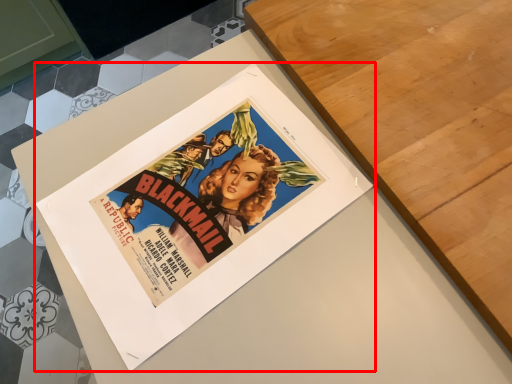
Question: From the image's perspective, where is poster (annotated by the red box) located relative to table?

Choices:
 (A) above
 (B) below

Answer: (B)